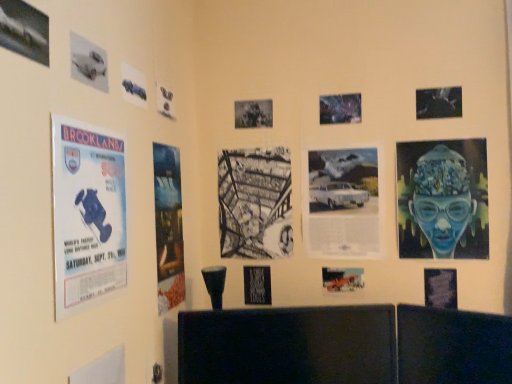
Question: Is black paper at center, which is counted as the seventh poster, starting from the left, aimed at metallic silver poster at upper center, which is the sixth poster in right-to-left order?

Choices:
 (A) no
 (B) yes

Answer: (A)

Question: From a real-world perspective, is black paper at center, acting as the eighth poster starting from the right, on top of metallic silver poster at upper center, which is the sixth poster in right-to-left order?

Choices:
 (A) no
 (B) yes

Answer: (B)

Question: Is black paper at center, which is counted as the seventh poster, starting from the left, far away from metallic silver poster at upper center, which is the sixth poster in right-to-left order?

Choices:
 (A) no
 (B) yes

Answer: (A)

Question: Can you confirm if black paper at center, which is counted as the seventh poster, starting from the left, is positioned to the right of metallic silver poster at upper center, which is the 9th poster in left-to-right order?

Choices:
 (A) yes
 (B) no

Answer: (B)

Question: Does black paper at center, acting as the eighth poster starting from the right, have a greater width compared to metallic silver poster at upper center, which is the sixth poster in right-to-left order?

Choices:
 (A) yes
 (B) no

Answer: (A)

Question: Is black paper at center, which is counted as the seventh poster, starting from the left, smaller than metallic silver poster at upper center, which is the sixth poster in right-to-left order?

Choices:
 (A) no
 (B) yes

Answer: (A)

Question: Does blue glossy portrait at right, placed as the first poster when sorted from right to left, have a larger size compared to blue paper poster at left, marked as the third poster in a left-to-right arrangement?

Choices:
 (A) no
 (B) yes

Answer: (A)

Question: Does blue glossy portrait at right, which is the fourteenth poster in left-to-right order, appear on the right side of blue paper poster at left, marked as the third poster in a left-to-right arrangement?

Choices:
 (A) no
 (B) yes

Answer: (B)

Question: Does blue glossy portrait at right, placed as the first poster when sorted from right to left, contain blue paper poster at left, marked as the third poster in a left-to-right arrangement?

Choices:
 (A) yes
 (B) no

Answer: (B)

Question: Does blue glossy portrait at right, which is the fourteenth poster in left-to-right order, come in front of blue paper poster at left, marked as the third poster in a left-to-right arrangement?

Choices:
 (A) yes
 (B) no

Answer: (B)

Question: Can you confirm if blue glossy portrait at right, which is the fourteenth poster in left-to-right order, is shorter than blue paper poster at left, arranged as the 12th poster when viewed from the right?

Choices:
 (A) yes
 (B) no

Answer: (A)

Question: From the image's perspective, is blue glossy portrait at right, which is the fourteenth poster in left-to-right order, on top of blue paper poster at left, marked as the third poster in a left-to-right arrangement?

Choices:
 (A) no
 (B) yes

Answer: (B)

Question: Is black paper at center, acting as the eighth poster starting from the right, not within white paper at center, placed as the fourth poster when sorted from right to left?

Choices:
 (A) no
 (B) yes

Answer: (B)